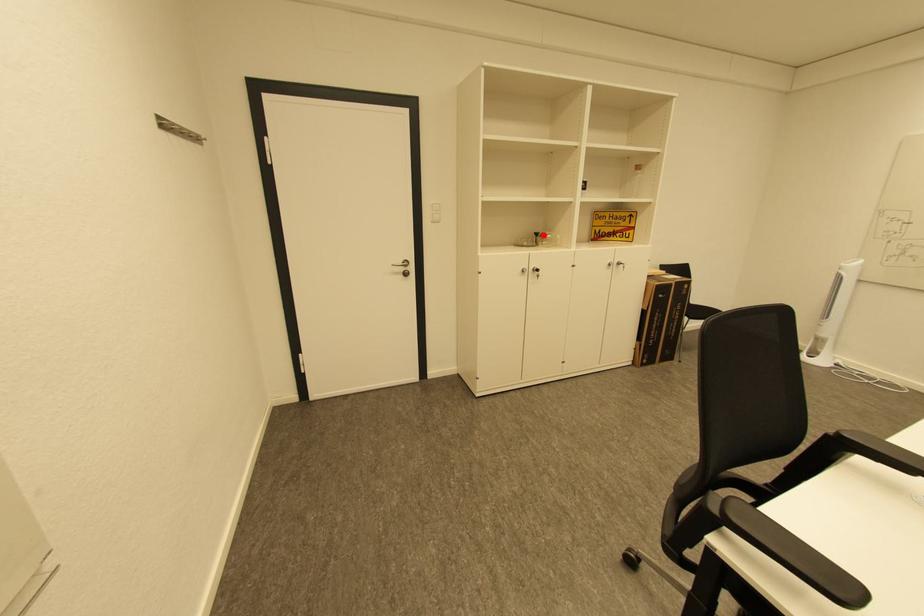
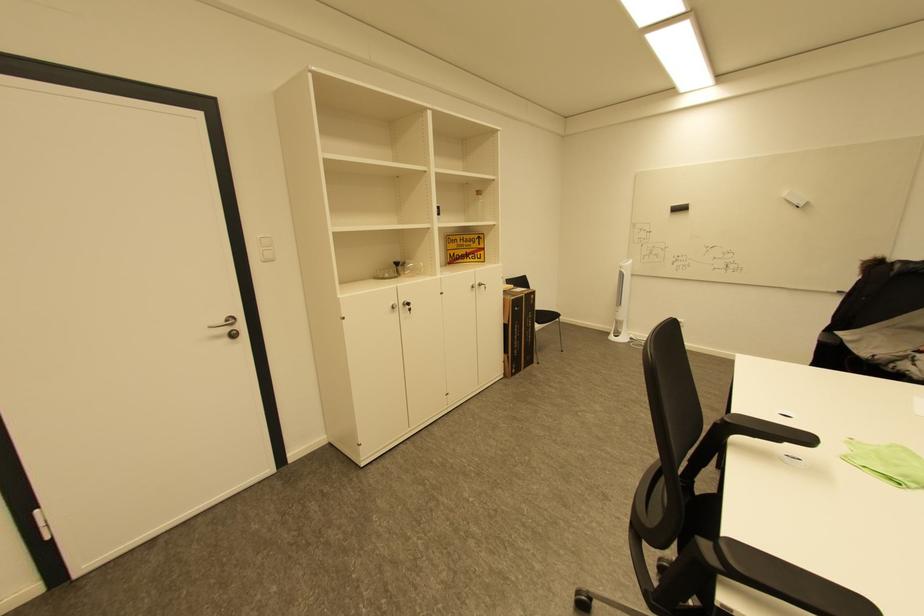
Find the pixel in the second image that matches the highlighted location in the first image.

(403, 264)